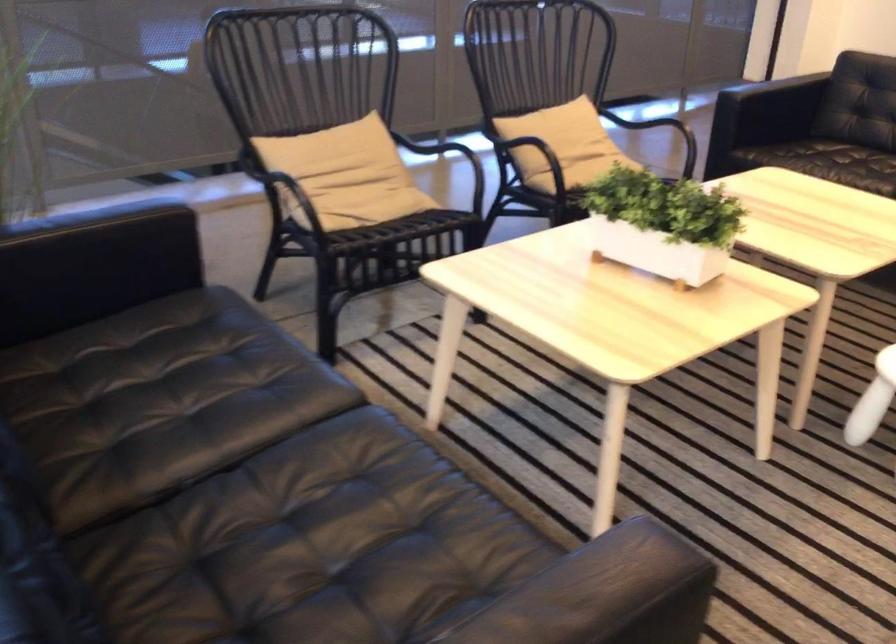
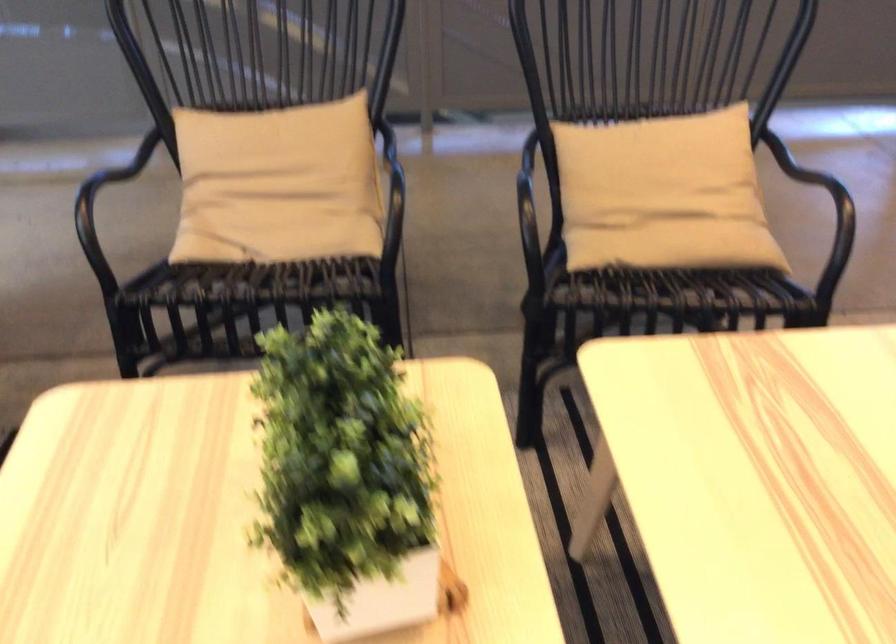
Find the pixel in the second image that matches (681,194) in the first image.

(346, 477)